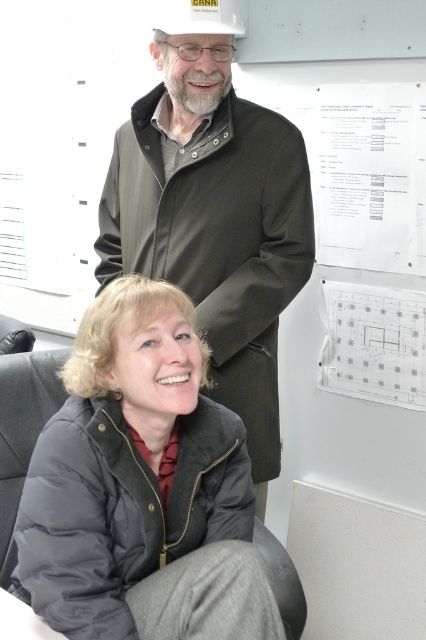
Between point (305, 237) and point (362, 364), which one is positioned in front?

Point (305, 237) is more forward.

Is point (265, 396) more distant than point (368, 301)?

No, it is in front of (368, 301).

Is point (150, 150) more distant than point (353, 316)?

No, (150, 150) is closer to viewer.

I want to click on green matte coat at center, so click(x=213, y=221).

Is dark gray puffer jacket at lower left shorter than white matte hat at upper center?

No, dark gray puffer jacket at lower left is not shorter than white matte hat at upper center.

Does dark gray puffer jacket at lower left have a greater height compared to white matte hat at upper center?

Correct, dark gray puffer jacket at lower left is much taller as white matte hat at upper center.

Find the location of a particular element. dark gray puffer jacket at lower left is located at coordinates (141, 486).

Can you confirm if dark gray puffer jacket at lower left is wider than green matte coat at center?

In fact, dark gray puffer jacket at lower left might be narrower than green matte coat at center.

Which is in front, point (126, 484) or point (166, 168)?

Positioned in front is point (126, 484).

Where is `dark gray puffer jacket at lower left`? Image resolution: width=426 pixels, height=640 pixels. dark gray puffer jacket at lower left is located at coordinates click(x=141, y=486).